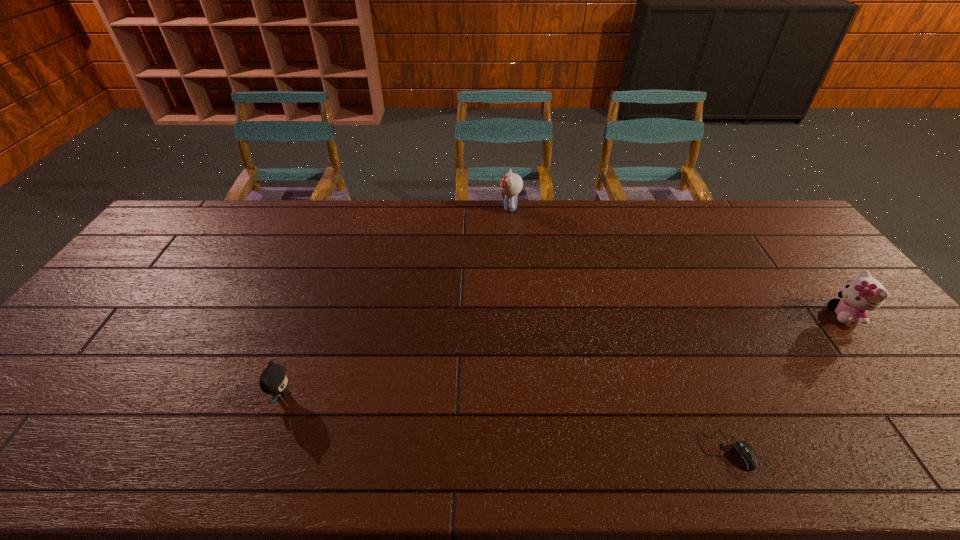
This screenshot has width=960, height=540. I want to click on vacant area situated 0.270m on the front-facing side of the farthest kitten, so click(426, 208).

The image size is (960, 540). I want to click on free space located on the front-facing side of the rightmost object, so click(x=753, y=315).

The height and width of the screenshot is (540, 960). I want to click on free space located 0.390m on the front-facing side of the rightmost object, so click(x=692, y=315).

Locate an element on the screen. This screenshot has height=540, width=960. vacant area situated 0.100m on the front-facing side of the rightmost object is located at coordinates (795, 315).

Identify the location of vacant space located on the front-facing side of the leftmost kitten. This screenshot has width=960, height=540. (461, 395).

Image resolution: width=960 pixels, height=540 pixels. In order to click on free spot located 0.230m on the left of the nearest object in this screenshot , I will do `click(597, 450)`.

Locate an element on the screen. The image size is (960, 540). object present at the far edge is located at coordinates (511, 184).

Where is `object that is at the near edge`? The image size is (960, 540). object that is at the near edge is located at coordinates (745, 454).

At what (x,y) coordinates should I click in order to perform the action: click on object at the right edge. Please return your answer as a coordinate pair (x, y). The image size is (960, 540). Looking at the image, I should click on (864, 293).

Locate an element on the screen. This screenshot has width=960, height=540. vacant space at the far edge of the desktop is located at coordinates (599, 210).